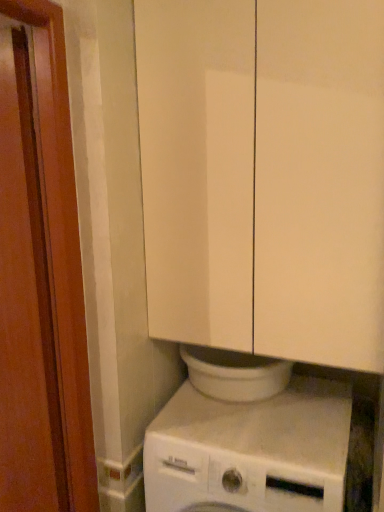
Describe the element at coordinates (264, 175) in the screenshot. The image size is (384, 512). I see `white glossy cabinet at upper center` at that location.

This screenshot has width=384, height=512. I want to click on brown wood screen door at left, so click(x=63, y=238).

Image resolution: width=384 pixels, height=512 pixels. What are the coordinates of `white glossy cabinet at upper center` in the screenshot? It's located at (264, 175).

Which object is more forward, brown wood screen door at left or white matte washing machine at lower center?

brown wood screen door at left is in front.

From a real-world perspective, is brown wood screen door at left physically located above or below white matte washing machine at lower center?

brown wood screen door at left is situated higher than white matte washing machine at lower center in the real world.

Based on the photo, considering the relative positions of brown wood screen door at left and white glossy cabinet at upper center in the image provided, is brown wood screen door at left to the right of white glossy cabinet at upper center from the viewer's perspective?

Incorrect, brown wood screen door at left is not on the right side of white glossy cabinet at upper center.

Is point (90, 428) positioned after point (202, 133)?

That is True.

Is brown wood screen door at left positioned beyond the bounds of white glossy cabinet at upper center?

Yes.

From the image's perspective, is brown wood screen door at left above or below white glossy cabinet at upper center?

brown wood screen door at left is below white glossy cabinet at upper center.

Which object is wider, white glossy cabinet at upper center or white matte washing machine at lower center?

With larger width is white matte washing machine at lower center.

Is white glossy cabinet at upper center looking in the opposite direction of white matte washing machine at lower center?

No.

Considering the positions of objects white glossy cabinet at upper center and white matte washing machine at lower center in the image provided, who is more to the right, white glossy cabinet at upper center or white matte washing machine at lower center?

white glossy cabinet at upper center.

Can you confirm if white glossy cabinet at upper center is wider than brown wood screen door at left?

Indeed, white glossy cabinet at upper center has a greater width compared to brown wood screen door at left.

Locate an element on the screen. This screenshot has height=512, width=384. screen door that is in front of the white glossy cabinet at upper center is located at coordinates (63, 238).

Considering the points (204, 203) and (4, 2), which point is behind, point (204, 203) or point (4, 2)?

The point (204, 203) is behind.

How far apart are white glossy cabinet at upper center and brown wood screen door at left?

The distance of white glossy cabinet at upper center from brown wood screen door at left is 18.80 inches.

From the image's perspective, which object appears higher, white matte washing machine at lower center or white glossy cabinet at upper center?

white glossy cabinet at upper center is shown above in the image.

Which is closer to the camera, [243,456] or [167,219]?

Clearly, point [243,456] is closer to the camera than point [167,219].

Choose the correct answer: Is white matte washing machine at lower center inside white glossy cabinet at upper center or outside it?

white matte washing machine at lower center is not enclosed by white glossy cabinet at upper center.

I want to click on washing machine lying behind the white glossy cabinet at upper center, so click(x=250, y=451).

Considering the relative sizes of white matte washing machine at lower center and brown wood screen door at left in the image provided, is white matte washing machine at lower center smaller than brown wood screen door at left?

Actually, white matte washing machine at lower center might be larger than brown wood screen door at left.

Consider the image. Considering the relative sizes of white matte washing machine at lower center and brown wood screen door at left in the image provided, is white matte washing machine at lower center wider than brown wood screen door at left?

Correct, the width of white matte washing machine at lower center exceeds that of brown wood screen door at left.

Is point (260, 480) farther from camera compared to point (89, 411)?

No.

Which is correct: white matte washing machine at lower center is inside brown wood screen door at left, or outside of it?

white matte washing machine at lower center exists outside the volume of brown wood screen door at left.

Identify the location of screen door above the white matte washing machine at lower center (from a real-world perspective). The width and height of the screenshot is (384, 512). (63, 238).

Locate an element on the screen. The height and width of the screenshot is (512, 384). screen door below the white glossy cabinet at upper center (from a real-world perspective) is located at coordinates (63, 238).

Looking at the image, which one is located closer to white matte washing machine at lower center, white glossy cabinet at upper center or brown wood screen door at left?

brown wood screen door at left lies closer to white matte washing machine at lower center than the other object.

Considering their positions, is white matte washing machine at lower center positioned further to brown wood screen door at left than white glossy cabinet at upper center?

Based on the image, white matte washing machine at lower center appears to be further to brown wood screen door at left.

Based on their spatial positions, is white matte washing machine at lower center or brown wood screen door at left further from white glossy cabinet at upper center?

white matte washing machine at lower center is positioned further to the anchor white glossy cabinet at upper center.

From the image, which object appears to be nearer to brown wood screen door at left, white glossy cabinet at upper center or white matte washing machine at lower center?

white glossy cabinet at upper center lies closer to brown wood screen door at left than the other object.

Estimate the real-world distances between objects in this image. Which object is further from white matte washing machine at lower center, brown wood screen door at left or white glossy cabinet at upper center?

Based on the image, white glossy cabinet at upper center appears to be further to white matte washing machine at lower center.

Which object lies further to the anchor point white glossy cabinet at upper center, brown wood screen door at left or white matte washing machine at lower center?

The object further to white glossy cabinet at upper center is white matte washing machine at lower center.

The height and width of the screenshot is (512, 384). Identify the location of screen door between white glossy cabinet at upper center and white matte washing machine at lower center in the up-down direction. (63, 238).